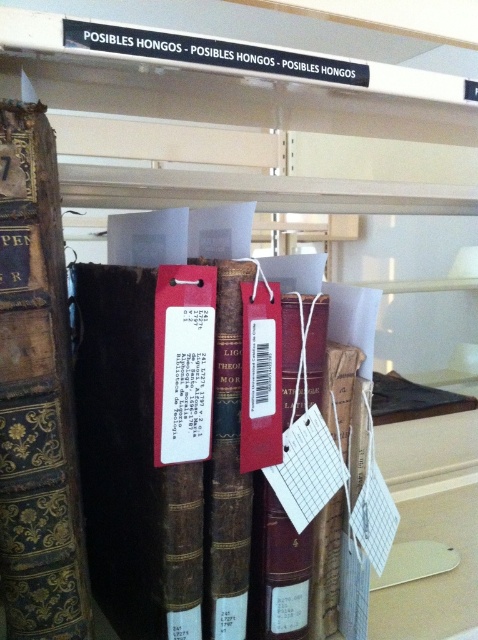
In the scene shown: Is brown leather book at center positioned at the back of gold embossed leather book at left?

Yes, it is.

Is brown leather book at center in front of gold embossed leather book at left?

No, brown leather book at center is further to the viewer.

Is point (127, 388) in front of point (50, 588)?

No, (127, 388) is further to viewer.

Where is `brown leather book at center`? This screenshot has height=640, width=478. brown leather book at center is located at coordinates (152, 426).